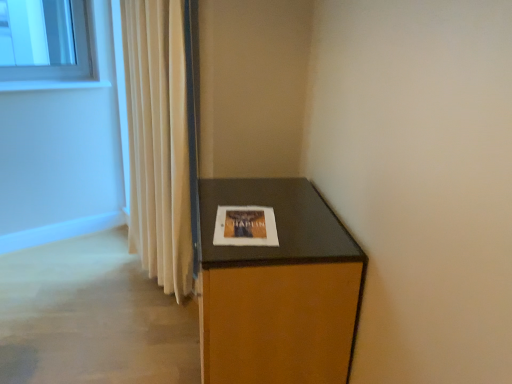
Identify the location of vacant space underneath matte white picture frame at center (from a real-world perspective). (241, 223).